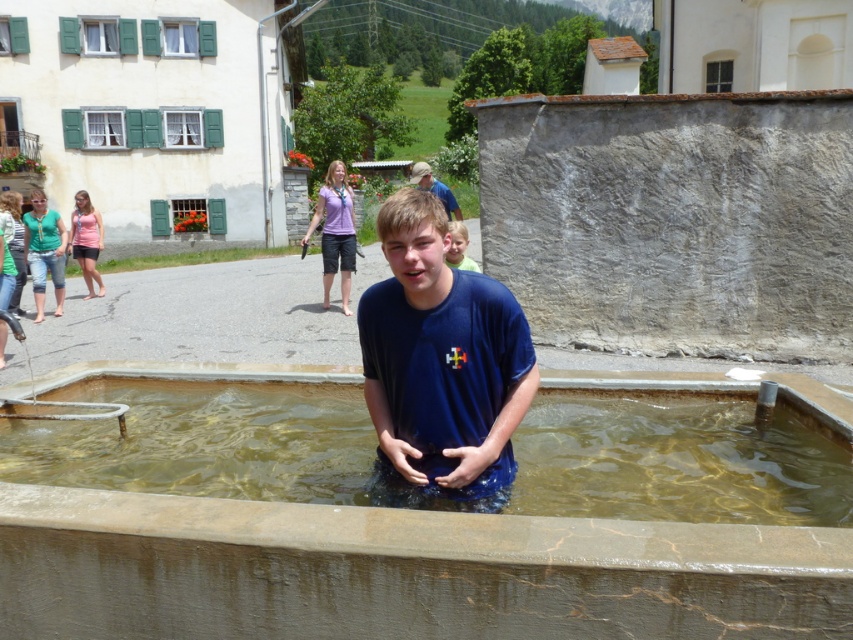
You are a photographer trying to capture the scene. You need to ensure that the clear concrete water at center and the light brown hair at upper right are both in focus. Considering their positions, which object is closer to the camera and might require adjusting the focus accordingly?

The light brown hair at upper right is closer to the camera than the clear concrete water at center, so you should adjust the focus to ensure both are sharp.

You are a photographer trying to capture the man in the blue matte shirt at center. The clear concrete water at center might interfere with your shot. Can you tell me which one is closer to the camera?

The blue matte shirt at center is closer to the camera than the clear concrete water at center because the blue matte shirt at center has a greater height than the clear concrete water at center.